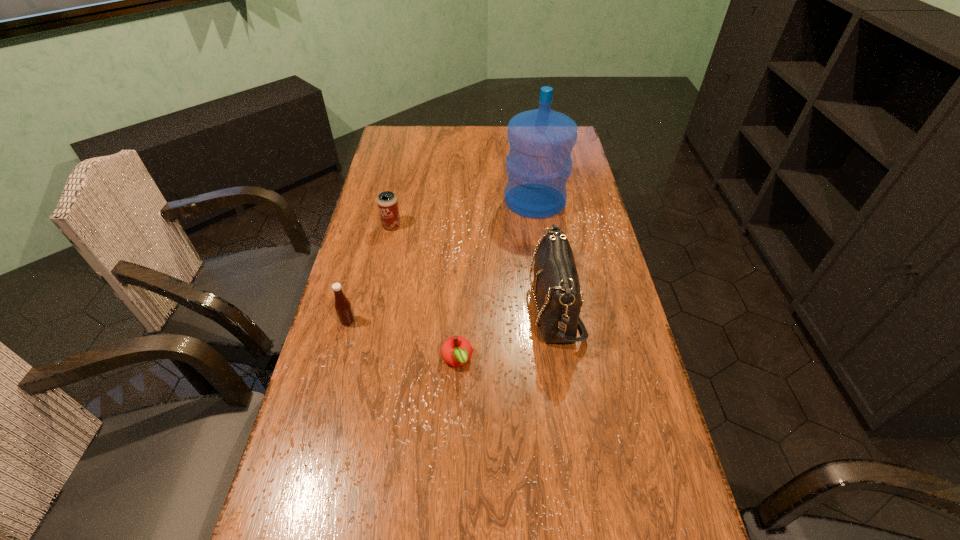
Where is `free region located 0.110m on the front of the third shortest object`? free region located 0.110m on the front of the third shortest object is located at coordinates (385, 254).

Find the location of a particular element. vacant space positioned on the back of the fourth object from left to right is located at coordinates (460, 301).

This screenshot has width=960, height=540. In order to click on Tabasco sauce at the left edge in this screenshot , I will do `click(343, 307)`.

The width and height of the screenshot is (960, 540). I want to click on beer can located at the left edge, so click(387, 203).

Identify the location of water jug present at the right edge. click(x=539, y=163).

Identify the location of handbag that is at the right edge. The image size is (960, 540). (557, 288).

You are a GUI agent. You are given a task and a screenshot of the screen. Output one action in this format:
    pyautogui.click(x=<x>, y=<y>)
    Task: Click on the vacant space at the far edge of the desktop
    This screenshot has height=540, width=960.
    Given the screenshot: What is the action you would take?
    pyautogui.click(x=425, y=153)

In the image, there is a desktop. Identify the location of free space at the left edge. This screenshot has width=960, height=540. (378, 231).

This screenshot has height=540, width=960. I want to click on free region at the right edge of the desktop, so click(664, 482).

The image size is (960, 540). In the image, there is a desktop. Find the location of `vacant space at the far left corner`. vacant space at the far left corner is located at coordinates (387, 141).